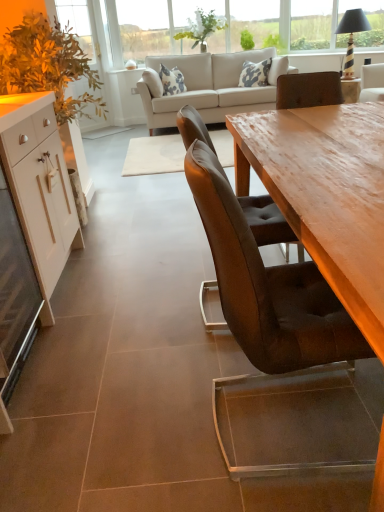
Question: Does point (41, 175) appear closer or farther from the camera than point (208, 19)?

Choices:
 (A) farther
 (B) closer

Answer: (B)

Question: Choose the correct answer: Is white glossy cabinet at left inside green leafy plant at upper center, which appears as the 1th plant when viewed from the left, or outside it?

Choices:
 (A) inside
 (B) outside

Answer: (B)

Question: Which object is the farthest from the clear glass window at upper center?

Choices:
 (A) white glossy cabinet at left
 (B) wooden striped base at upper right
 (C) white glossy cabinet at left
 (D) green leafy plant at upper center, which ranks as the 1th plant in right-to-left order
 (E) leather chair at center

Answer: (E)

Question: Which object is positioned farthest from the leather chair at center?

Choices:
 (A) beige fabric couch at upper center
 (B) white glossy cabinet at left
 (C) wooden striped base at upper right
 (D) wooden table at right
 (E) white glossy cabinet at left

Answer: (A)